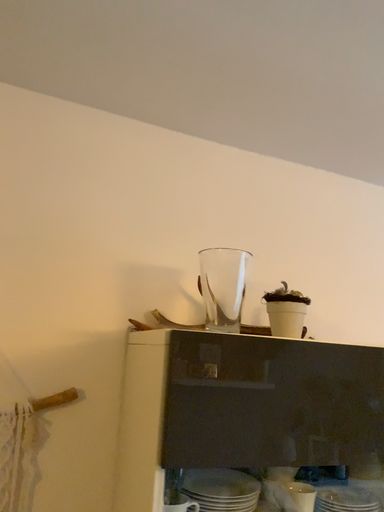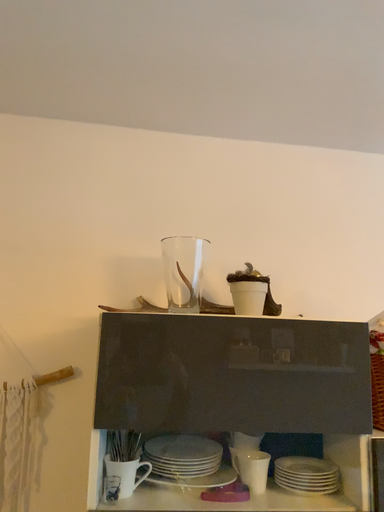
Question: How did the camera likely rotate when shooting the video?

Choices:
 (A) rotated right
 (B) rotated left

Answer: (B)